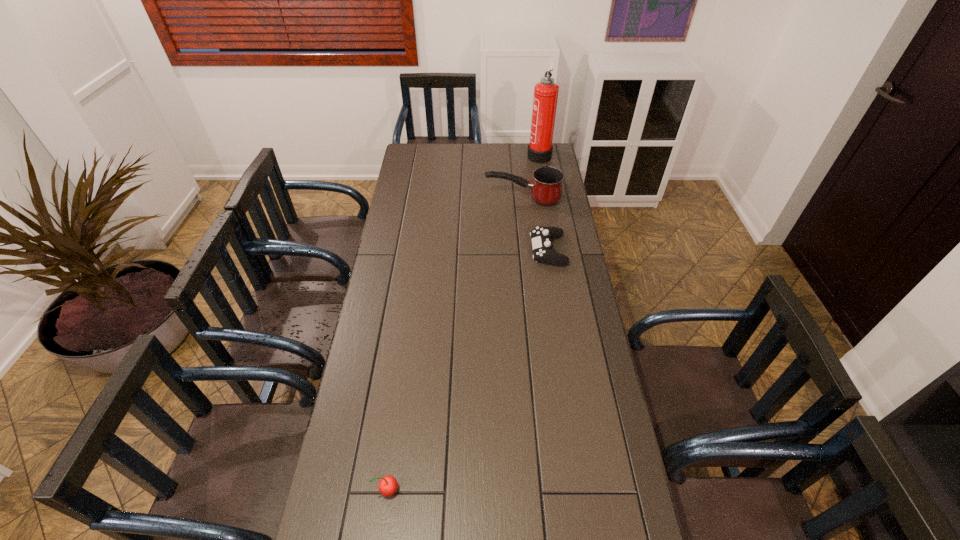
You are a GUI agent. You are given a task and a screenshot of the screen. Output one action in this format:
    pyautogui.click(x=<x>, y=<y>)
    Task: Click on the vacant space that is in between the cherry and the tallest object
    Image resolution: width=960 pixels, height=540 pixels.
    Given the screenshot: What is the action you would take?
    pyautogui.click(x=463, y=322)

Identify the location of empty space between the third shortest object and the farthest object. The image size is (960, 540). (531, 177).

What are the coordinates of `empty space that is in between the cherry and the fire extinguisher` in the screenshot? It's located at (463, 322).

The height and width of the screenshot is (540, 960). I want to click on free space that is in between the shortest object and the cherry, so (468, 370).

At what (x,y) coordinates should I click in order to perform the action: click on free space between the fire extinguisher and the third shortest object. Please return your answer as a coordinate pair (x, y). This screenshot has width=960, height=540. Looking at the image, I should click on (531, 177).

Where is `vacant space that is in between the tallest object and the third shortest object`? The image size is (960, 540). vacant space that is in between the tallest object and the third shortest object is located at coordinates (531, 177).

The width and height of the screenshot is (960, 540). Identify the location of object that can be found as the second closest to the second farthest object. (540, 148).

You are a GUI agent. You are given a task and a screenshot of the screen. Output one action in this format:
    pyautogui.click(x=<x>, y=<y>)
    Task: Click on the object that stands as the closest to the second nearest object
    The width and height of the screenshot is (960, 540).
    Given the screenshot: What is the action you would take?
    pyautogui.click(x=546, y=188)